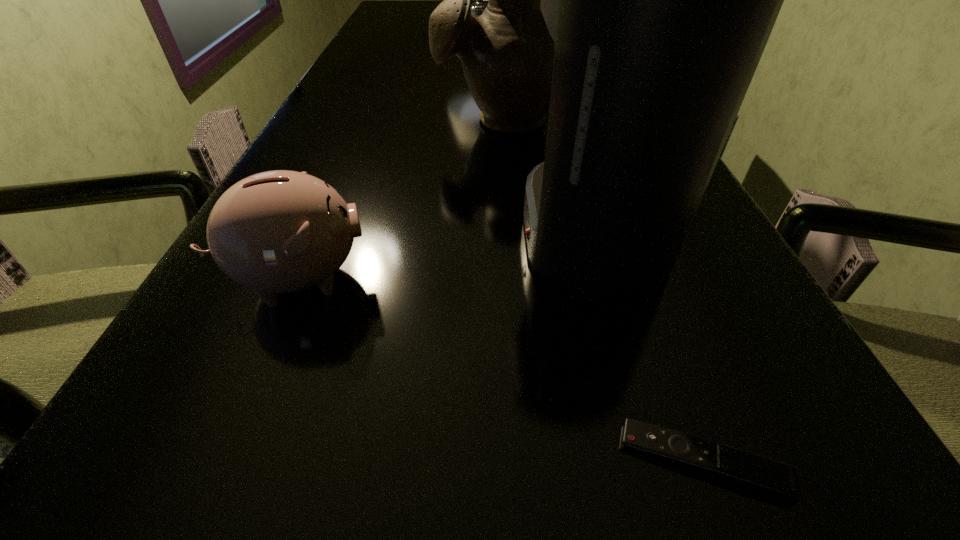
Where is `the farthest object`? The height and width of the screenshot is (540, 960). the farthest object is located at coordinates (477, 8).

You are a GUI agent. You are given a task and a screenshot of the screen. Output one action in this format:
    pyautogui.click(x=<x>, y=<y>)
    Task: Click on the lampshade
    
    Given the screenshot: What is the action you would take?
    pyautogui.click(x=477, y=8)

Where is `coffee maker`? This screenshot has height=540, width=960. coffee maker is located at coordinates (660, 0).

You are a GUI agent. You are given a task and a screenshot of the screen. Output one action in this format:
    pyautogui.click(x=<x>, y=<y>)
    Task: Click on the second farthest object
    The width and height of the screenshot is (960, 540).
    Given the screenshot: What is the action you would take?
    pyautogui.click(x=507, y=53)

Identify the location of piggy bank. (276, 232).

Find the location of `the second shortest object`. the second shortest object is located at coordinates (276, 232).

Identify the location of the shortest object. (759, 473).

Identify the location of remote control. (759, 473).

Find the location of `free point located on the lampshade of the lampshade`. free point located on the lampshade of the lampshade is located at coordinates (478, 76).

Where is `vacant area situated on the button side of the coffee maker`? vacant area situated on the button side of the coffee maker is located at coordinates [x=355, y=233].